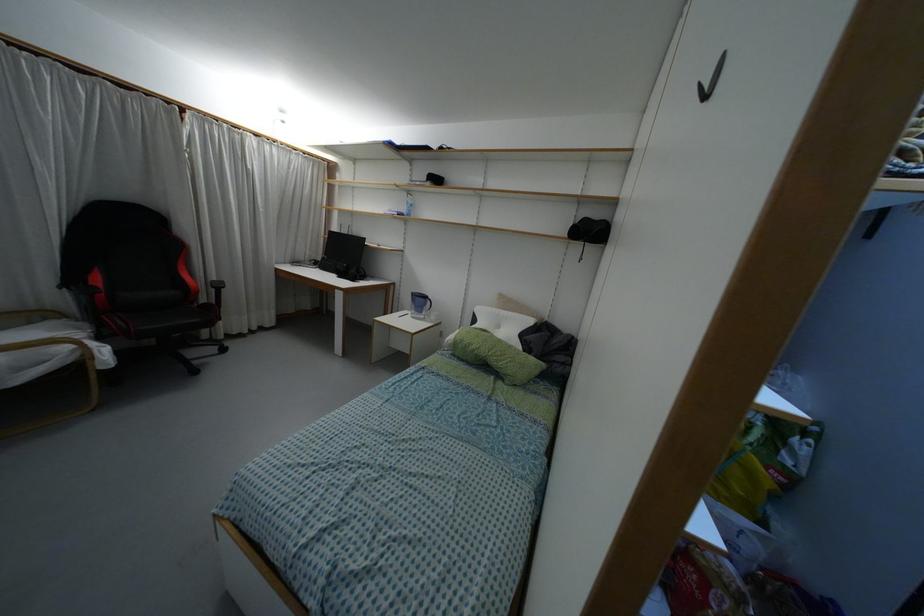
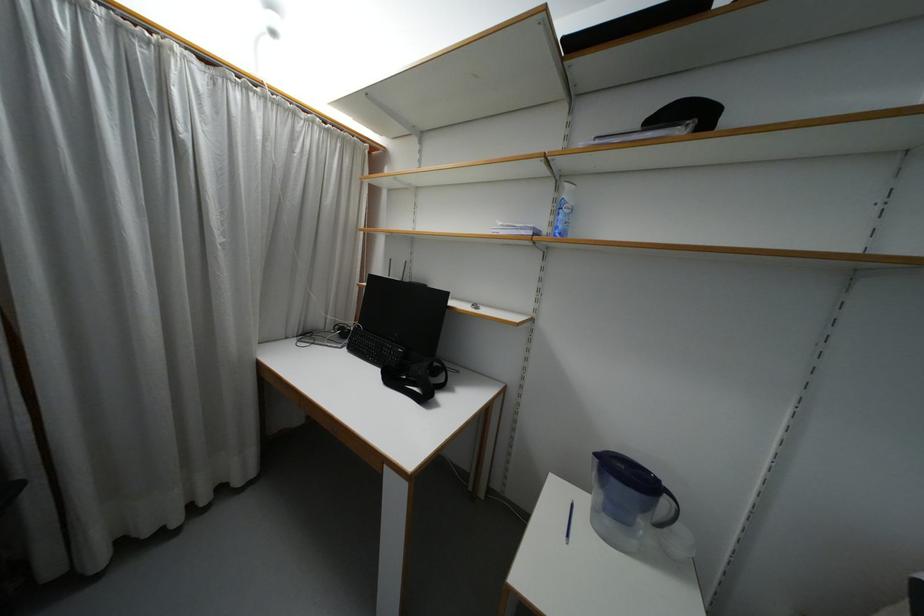
What movement of the cameraman would produce the second image?

The movement direction of the cameraman is left, forward.